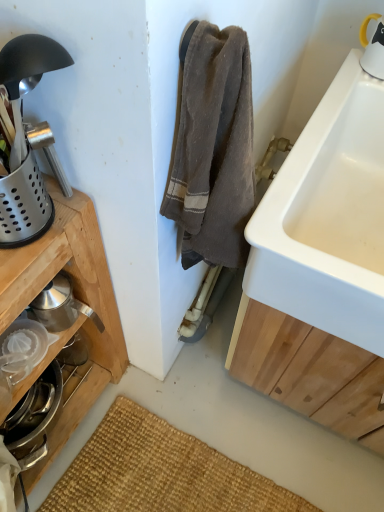
The width and height of the screenshot is (384, 512). What do you see at coordinates (328, 217) in the screenshot?
I see `white ceramic sink at right` at bounding box center [328, 217].

The width and height of the screenshot is (384, 512). What are the coordinates of `white ceramic sink at right` in the screenshot? It's located at (328, 217).

Measure the distance between point (347, 82) and camera.

A distance of 34.21 inches exists between point (347, 82) and camera.

What do you see at coordinates (34, 418) in the screenshot? Image resolution: width=384 pixels, height=512 pixels. I see `stainless steel juicer at lower left` at bounding box center [34, 418].

At what (x,y) coordinates should I click in order to perform the action: click on stainless steel juicer at lower left. Please return your answer as a coordinate pair (x, y). The image size is (384, 512). Looking at the image, I should click on (34, 418).

In order to face stainless steel juicer at lower left, should I rotate leftwards or rightwards?

Turn left by 20.513 degrees to look at stainless steel juicer at lower left.

The image size is (384, 512). What are the coordinates of `white ceramic sink at right` in the screenshot? It's located at (328, 217).

Is white ceramic sink at right at the left side of stainless steel juicer at lower left?

No.

Relative to stainless steel juicer at lower left, is white ceramic sink at right in front or behind?

white ceramic sink at right is in front of stainless steel juicer at lower left.

Does point (350, 157) come behind point (34, 383)?

No, it is not.

From the image's perspective, is white ceramic sink at right located above or below stainless steel juicer at lower left?

white ceramic sink at right is above stainless steel juicer at lower left.

From a real-world perspective, does white ceramic sink at right stand above stainless steel juicer at lower left?

Indeed, from a real-world perspective, white ceramic sink at right stands above stainless steel juicer at lower left.

Between white ceramic sink at right and stainless steel juicer at lower left, which one has larger width?

Wider between the two is white ceramic sink at right.

Considering the relative sizes of white ceramic sink at right and stainless steel juicer at lower left in the image provided, is white ceramic sink at right shorter than stainless steel juicer at lower left?

Incorrect, the height of white ceramic sink at right does not fall short of that of stainless steel juicer at lower left.

Considering the relative sizes of white ceramic sink at right and stainless steel juicer at lower left in the image provided, is white ceramic sink at right bigger than stainless steel juicer at lower left?

Correct, white ceramic sink at right is larger in size than stainless steel juicer at lower left.

Is white ceramic sink at right inside or outside of stainless steel juicer at lower left?

white ceramic sink at right is located beyond the bounds of stainless steel juicer at lower left.

Is white ceramic sink at right far from stainless steel juicer at lower left?

No, white ceramic sink at right is in close proximity to stainless steel juicer at lower left.

Is white ceramic sink at right facing away from stainless steel juicer at lower left?

No.

In the image, there is a stainless steel juicer at lower left. Where is `sink above it (from the image's perspective)`? sink above it (from the image's perspective) is located at coordinates (328, 217).

Considering the relative positions of stainless steel juicer at lower left and white ceramic sink at right in the image provided, is stainless steel juicer at lower left to the left of white ceramic sink at right from the viewer's perspective?

Correct, you'll find stainless steel juicer at lower left to the left of white ceramic sink at right.

Is the position of stainless steel juicer at lower left more distant than that of white ceramic sink at right?

Yes, stainless steel juicer at lower left is further from the camera.

Between point (25, 446) and point (381, 117), which one is positioned behind?

The point (25, 446) is farther.

From the image's perspective, which is below, stainless steel juicer at lower left or white ceramic sink at right?

From the image's view, stainless steel juicer at lower left is below.

From a real-world perspective, is stainless steel juicer at lower left below white ceramic sink at right?

Yes.

Is stainless steel juicer at lower left wider than white ceramic sink at right?

No.

Can you confirm if stainless steel juicer at lower left is shorter than white ceramic sink at right?

Indeed, stainless steel juicer at lower left has a lesser height compared to white ceramic sink at right.

Is stainless steel juicer at lower left smaller than white ceramic sink at right?

Indeed, stainless steel juicer at lower left has a smaller size compared to white ceramic sink at right.

Can white ceramic sink at right be found inside stainless steel juicer at lower left?

Actually, white ceramic sink at right is outside stainless steel juicer at lower left.

Can you see stainless steel juicer at lower left touching white ceramic sink at right?

They are not placed beside each other.

Is stainless steel juicer at lower left facing towards white ceramic sink at right?

No, stainless steel juicer at lower left is not facing towards white ceramic sink at right.

How many degrees apart are the facing directions of stainless steel juicer at lower left and white ceramic sink at right?

They differ by 88.4 degrees in their facing directions.

The height and width of the screenshot is (512, 384). Identify the location of sink located in front of the stainless steel juicer at lower left. (328, 217).

Find the location of a particular element. Image resolution: width=384 pixels, height=512 pixels. sink lying above the stainless steel juicer at lower left (from the image's perspective) is located at coordinates (328, 217).

Where is `sink that appears above the stainless steel juicer at lower left (from a real-world perspective)`? The height and width of the screenshot is (512, 384). sink that appears above the stainless steel juicer at lower left (from a real-world perspective) is located at coordinates (328, 217).